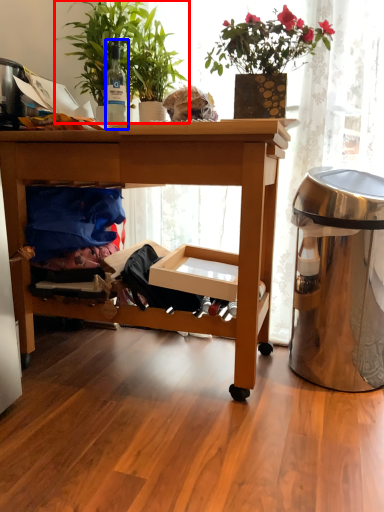
Question: Which point is closer to the camera, houseplant (highlighted by a red box) or bottle (highlighted by a blue box)?

Choices:
 (A) houseplant
 (B) bottle

Answer: (A)